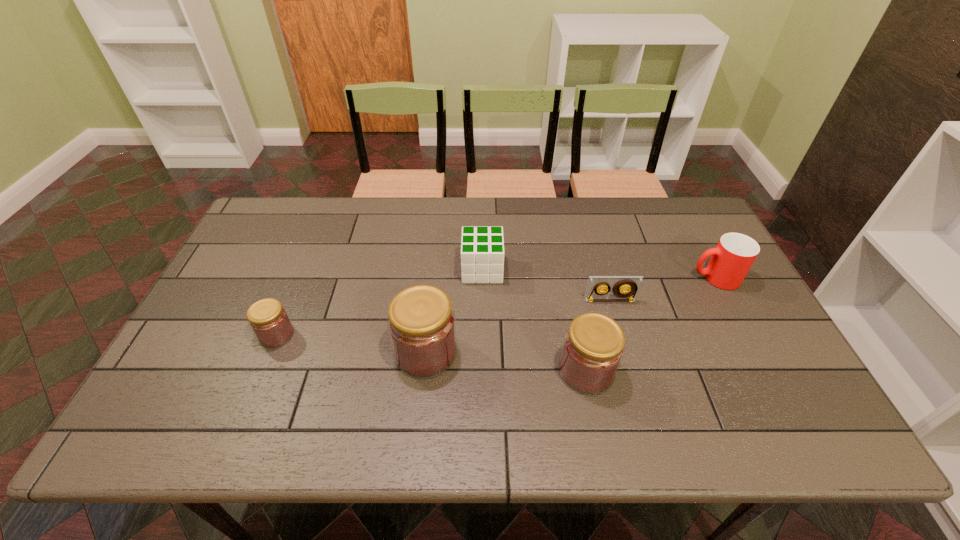
The height and width of the screenshot is (540, 960). I want to click on the shortest jam, so click(x=268, y=319).

This screenshot has height=540, width=960. I want to click on the leftmost object, so click(x=268, y=319).

I want to click on the fifth object from right to left, so click(421, 323).

In order to click on the second shortest jam in this screenshot , I will do `click(593, 348)`.

Locate an element on the screen. This screenshot has width=960, height=540. cup is located at coordinates (735, 253).

Where is `the third farthest object`? The height and width of the screenshot is (540, 960). the third farthest object is located at coordinates (595, 284).

I want to click on the fourth object from right to left, so click(x=484, y=254).

Locate an element on the screen. The image size is (960, 540). free space located on the right of the leftmost jam is located at coordinates (348, 335).

Where is `vacant space located 0.370m on the right of the fifth object from right to left`? Image resolution: width=960 pixels, height=540 pixels. vacant space located 0.370m on the right of the fifth object from right to left is located at coordinates (604, 352).

At what (x,y) coordinates should I click in order to perform the action: click on vacant space situated on the back of the rightmost jam. Please return your answer as a coordinate pair (x, y). The image size is (960, 540). Looking at the image, I should click on (568, 281).